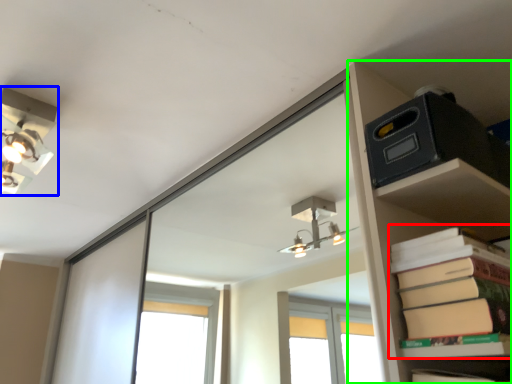
Question: Which object is positioned farthest from paperback book (highlighted by a red box)? Select from lamp (highlighted by a blue box) and shelf (highlighted by a green box).

Choices:
 (A) lamp
 (B) shelf

Answer: (A)